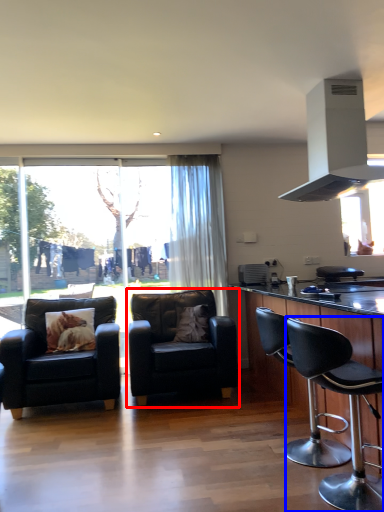
Question: Which object is further to the camera taking this photo, chair (highlighted by a red box) or chair (highlighted by a blue box)?

Choices:
 (A) chair
 (B) chair

Answer: (A)